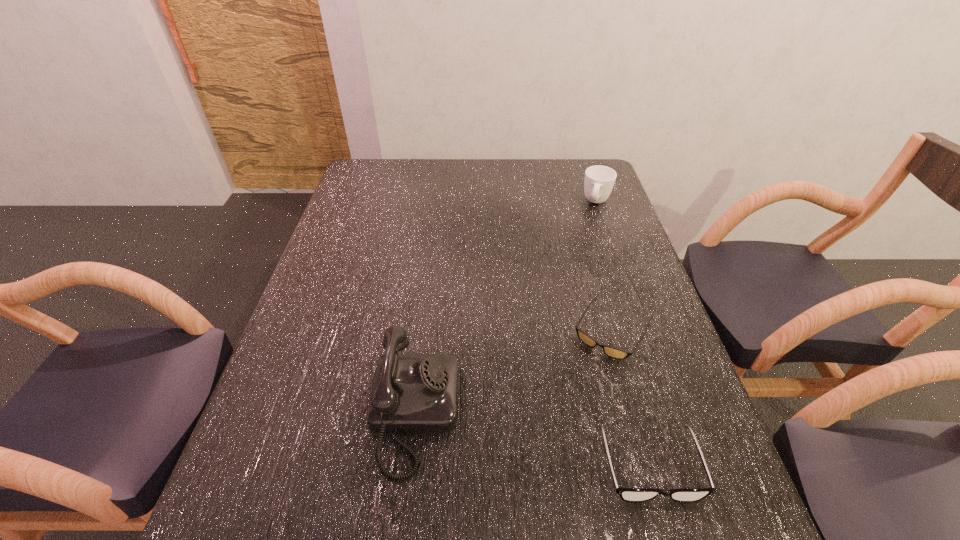
Where is `free area in between the shortest object and the third tallest object`? free area in between the shortest object and the third tallest object is located at coordinates (631, 397).

In order to click on vacant space that is in between the telephone and the sunglasses in this screenshot , I will do `click(514, 371)`.

Where is `vacant space that is in between the sunglasses and the cup`? The image size is (960, 540). vacant space that is in between the sunglasses and the cup is located at coordinates (605, 266).

I want to click on vacant space in between the telephone and the shortest object, so click(x=514, y=371).

Find the location of a particular element. The height and width of the screenshot is (540, 960). empty space that is in between the shortest object and the tallest object is located at coordinates (514, 371).

Locate an element on the screen. free space between the spectacles and the shortest object is located at coordinates (631, 397).

You are a GUI agent. You are given a task and a screenshot of the screen. Output one action in this format:
    pyautogui.click(x=<x>, y=<y>)
    Task: Click on the empty space between the telephone and the second shortest object
    The width and height of the screenshot is (960, 540).
    Given the screenshot: What is the action you would take?
    click(x=532, y=439)

Identify the location of object that stands as the third closest to the telephone. This screenshot has height=540, width=960. (599, 180).

Identify which object is the nearest to the telephone. Please provide its 2D coordinates. Your answer should be formatted as a tuple, i.e. [(x, y)], where the tuple contains the x and y coordinates of a point satisfying the conditions above.

[(610, 351)]

The height and width of the screenshot is (540, 960). What are the coordinates of `free spot that satisfies the following two spatial constraints: 1. on the back side of the farthest object; 2. on the left side of the sunglasses` in the screenshot? It's located at (576, 202).